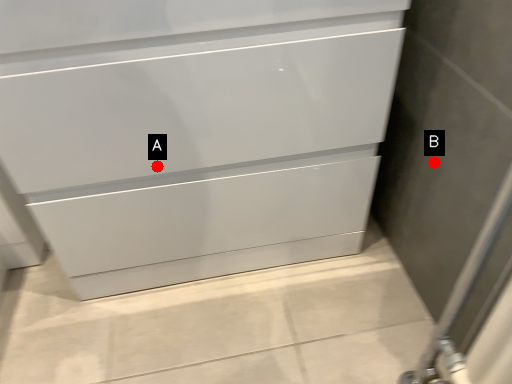
Question: Two points are circled on the image, labeled by A and B beside each circle. Which point is further to the camera?

Choices:
 (A) A is further
 (B) B is further

Answer: (B)